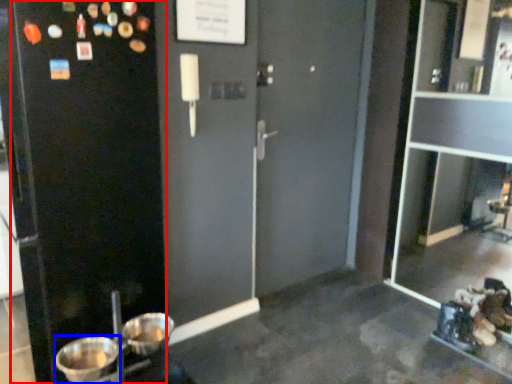
Question: Among these objects, which one is nearest to the camera, screen door (highlighted by a red box) or basin (highlighted by a blue box)?

Choices:
 (A) screen door
 (B) basin

Answer: (A)